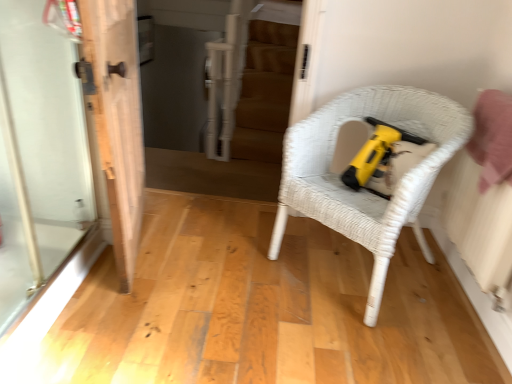
Locate an element on the screen. The image size is (512, 384). vacant position to the left of white wicker chair at center is located at coordinates (229, 268).